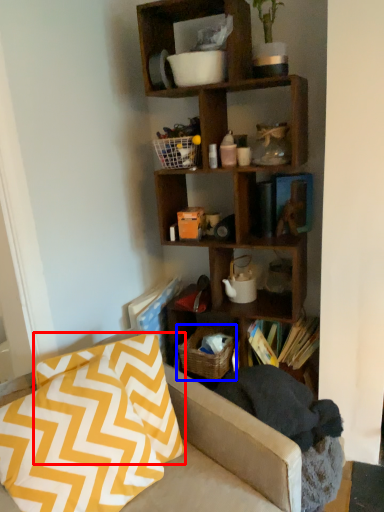
Question: Which point is further to the camera, pillow (highlighted by a red box) or basket (highlighted by a blue box)?

Choices:
 (A) pillow
 (B) basket

Answer: (B)